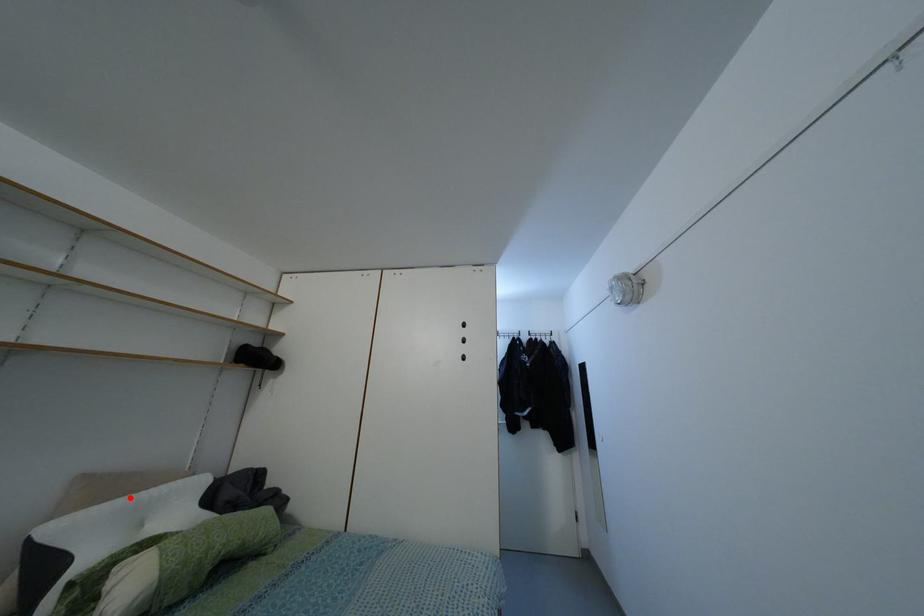
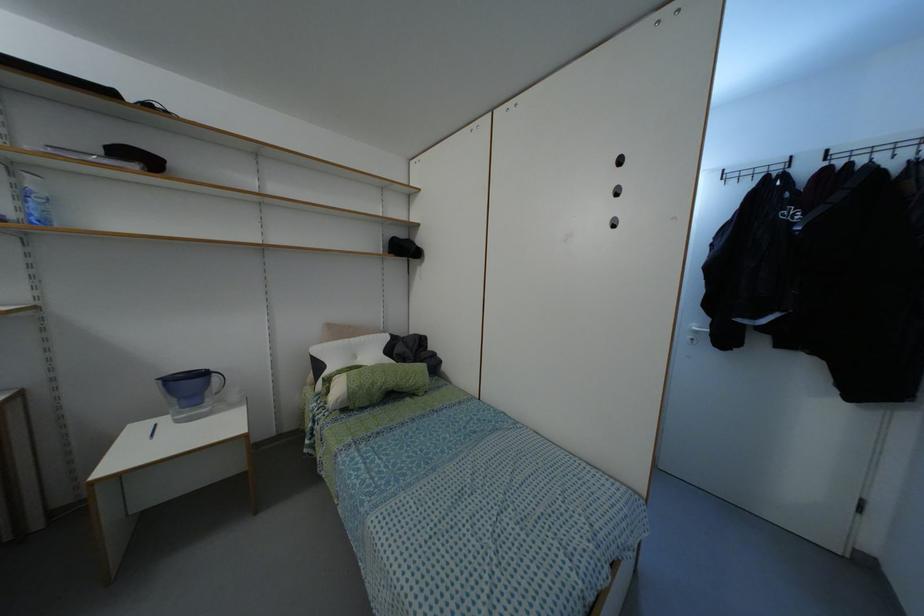
Question: I am providing you with two images of the same scene from different viewpoints. Given a red point in image1, look at the same physical point in image2. Is it:

Choices:
 (A) Closer to the viewpoint
 (B) Farther from the viewpoint

Answer: (B)